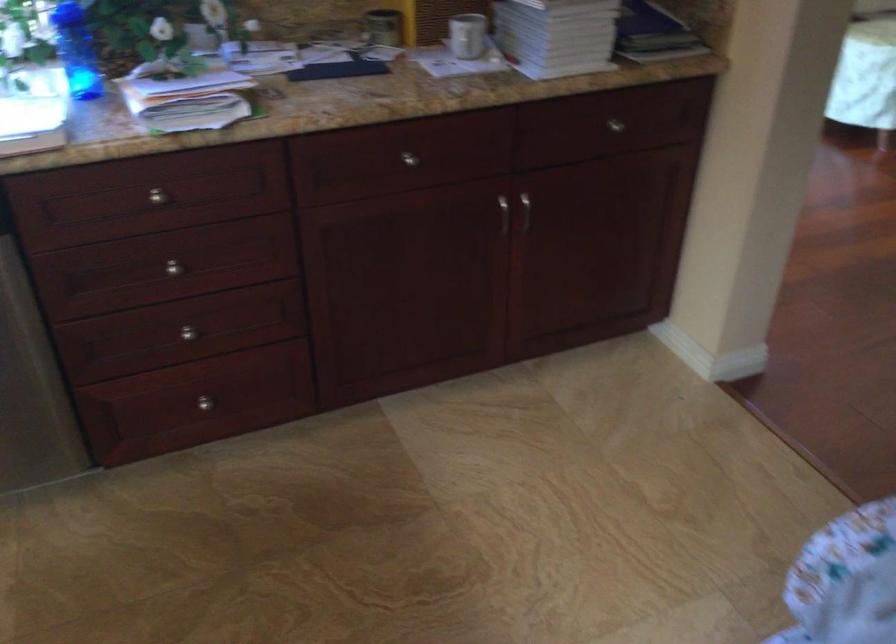
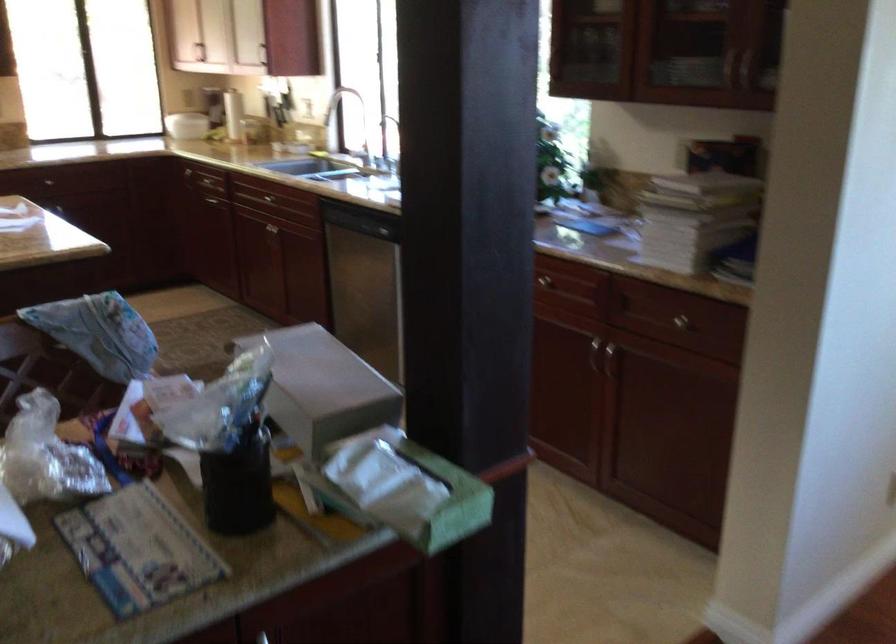
Question: I am providing you with two images of the same scene from different viewpoints. Which of the following objects are not visible in image2?

Choices:
 (A) wooden storage crate
 (B) silver drawer knob
 (C) green tissue box
 (D) faucet handle

Answer: (B)